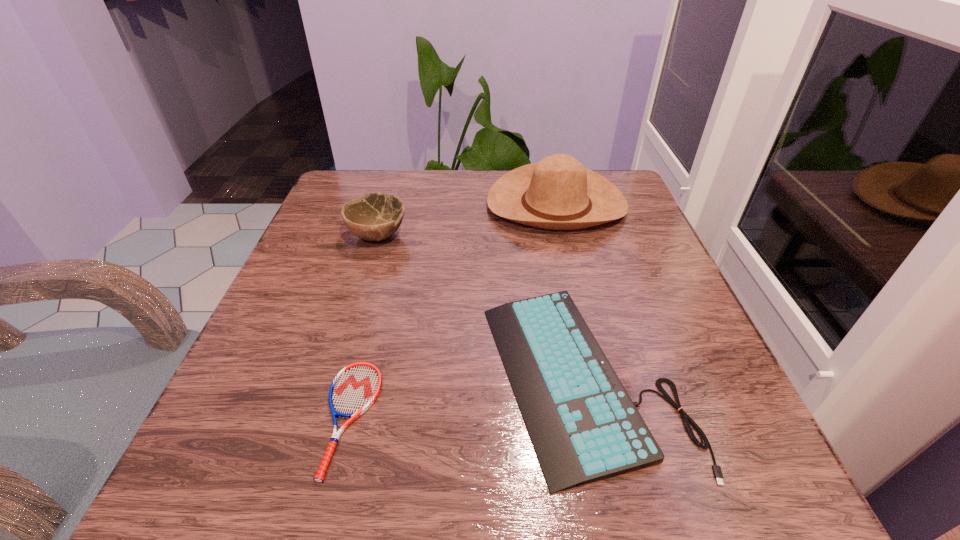
Locate an element on the screen. Image resolution: width=960 pixels, height=540 pixels. free area in between the shortest object and the cowboy hat is located at coordinates (453, 312).

At what (x,y) coordinates should I click in order to perform the action: click on free space between the third shortest object and the computer keyboard. Please return your answer as a coordinate pair (x, y). Looking at the image, I should click on (480, 306).

Where is `unoccupied area between the cowboy hat and the third tallest object`? unoccupied area between the cowboy hat and the third tallest object is located at coordinates (569, 291).

Identify the location of free spot between the bowl and the shortest object. (364, 327).

You are a GUI agent. You are given a task and a screenshot of the screen. Output one action in this format:
    pyautogui.click(x=<x>, y=<y>)
    Task: Click on the vacant area that lies between the tennis racket and the second tallest object
    This screenshot has width=960, height=540.
    Given the screenshot: What is the action you would take?
    pyautogui.click(x=364, y=327)

This screenshot has width=960, height=540. I want to click on unoccupied position between the tennis racket and the third shortest object, so click(x=364, y=327).

Locate which object ranks second in proximity to the bowl. Please provide its 2D coordinates. Your answer should be formatted as a tuple, i.e. [(x, y)], where the tuple contains the x and y coordinates of a point satisfying the conditions above.

[(584, 427)]

Locate an element on the screen. the third closest object relative to the second tallest object is located at coordinates (355, 388).

Identify the location of blank area in the image that satisfies the following two spatial constraints: 1. on the front side of the computer keyboard; 2. on the left side of the second tallest object. This screenshot has width=960, height=540. (336, 377).